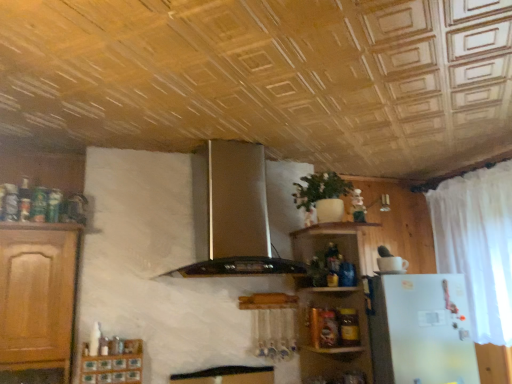
Question: Based on their positions, is satin silver exhaust hood at center located to the left or right of green matte plant at center?

Choices:
 (A) left
 (B) right

Answer: (A)

Question: Based on their sizes in the image, would you say satin silver exhaust hood at center is bigger or smaller than green matte plant at center?

Choices:
 (A) big
 (B) small

Answer: (A)

Question: Which of these objects is positioned closest to the satin silver exhaust hood at center?

Choices:
 (A) wooden shelves at upper right
 (B) satin silver refrigerator at right
 (C) wooden spice rack at lower left
 (D) green matte plant at center
 (E) white sheer curtain at right

Answer: (A)

Question: Based on their relative distances, which object is nearer to the white sheer curtain at right?

Choices:
 (A) green matte plant at center
 (B) satin silver refrigerator at right
 (C) wooden spice rack at lower left
 (D) wooden shelves at upper right
 (E) satin silver exhaust hood at center

Answer: (B)